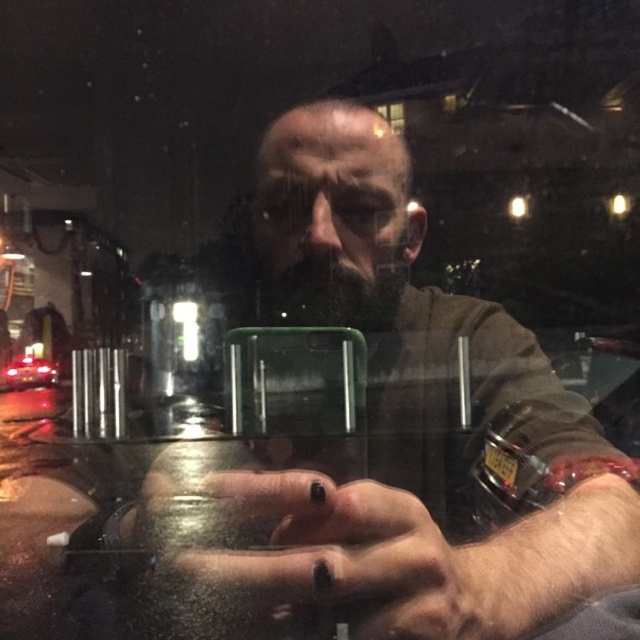
You are a driver who wants to check if there is enough space between your black matte nails at center and the shiny red car at center to safely pass through. According to the scene, what is the minimum distance you need to maintain between them to avoid collision?

The black matte nails at center and shiny red car at center are 8.87 feet apart from each other, so maintaining at least 8.87 feet distance would prevent collision.

You are a passenger in the car and want to check the time on your matte black wristwatch at center. However, the clear glass window at upper center is reflecting some light. Will you need to move your hand away from the window to see your wristwatch clearly?

The matte black wristwatch at center is closer to the viewer than the clear glass window at upper center, so you can see it without moving your hand away from the window.

You are a passenger in the vehicle and want to take a photo of the shiny red car at center through the clear glass window at upper center. Can you do this without moving your head?

The shiny red car at center is to the left of the clear glass window at upper center, so you can take the photo without moving your head by positioning the phone to the left side of the window.